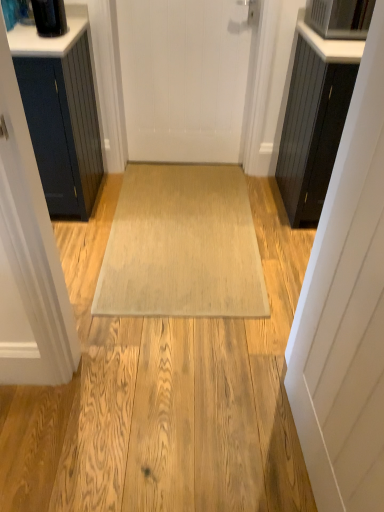
At what (x,y) coordinates should I click in order to perform the action: click on vacant point to the left of white matte door at right, which appears as the second door when viewed from the back. Please return your answer as a coordinate pair (x, y). Looking at the image, I should click on (224, 444).